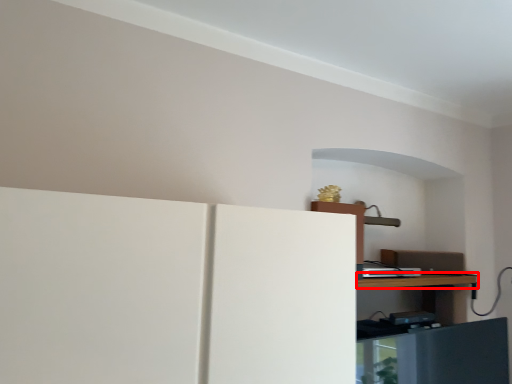
Question: From the image's perspective, considering the relative positions of table (annotated by the red box) and appliance in the image provided, where is table (annotated by the red box) located with respect to the staircase?

Choices:
 (A) below
 (B) above

Answer: (A)